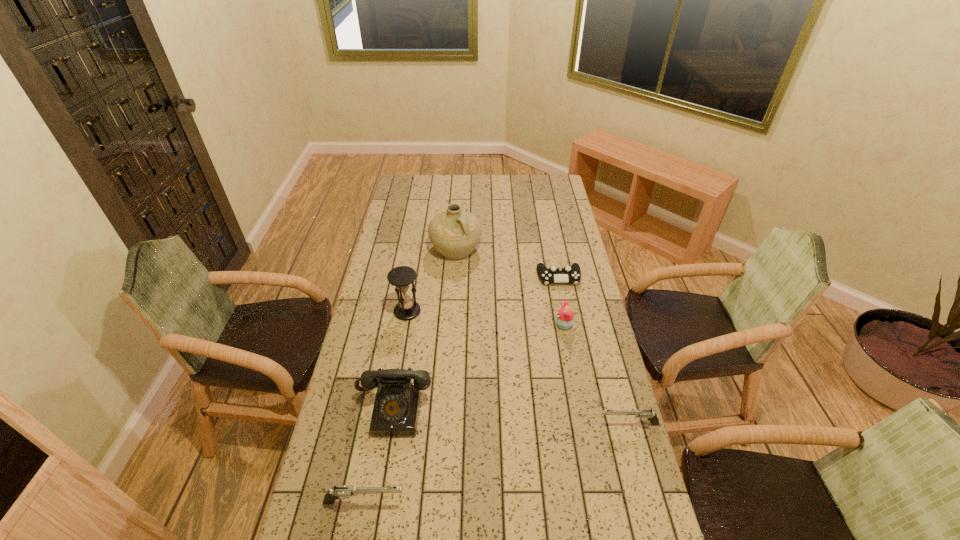
I want to click on vacant space located 0.130m on the front-facing side of the nearer pistol, so click(x=453, y=502).

Find the location of a particular element. This screenshot has height=540, width=960. free region located 0.230m on the front-facing side of the right pistol is located at coordinates (525, 424).

At what (x,y) coordinates should I click in order to perform the action: click on vacant area situated on the front-facing side of the right pistol. Please return your answer as a coordinate pair (x, y). Image resolution: width=960 pixels, height=540 pixels. Looking at the image, I should click on (481, 424).

I want to click on vacant position located on the front-facing side of the right pistol, so click(x=548, y=424).

Where is `free spot located 0.320m on the right of the pottery`? This screenshot has height=540, width=960. free spot located 0.320m on the right of the pottery is located at coordinates (552, 250).

The height and width of the screenshot is (540, 960). In order to click on vacant space located on the face of the cupcake in this screenshot , I will do pyautogui.click(x=487, y=325).

Locate an element on the screen. vacant region located 0.060m on the face of the cupcake is located at coordinates (540, 325).

Where is `free spot located on the face of the cupcake`? Image resolution: width=960 pixels, height=540 pixels. free spot located on the face of the cupcake is located at coordinates (453, 325).

Identify the location of blank area located 0.260m on the front of the second tallest object. (396, 377).

At what (x,y) coordinates should I click in order to perform the action: click on vacant region located on the surface of the control. Please return your answer as a coordinate pair (x, y). The image size is (960, 540). Looking at the image, I should click on (568, 327).